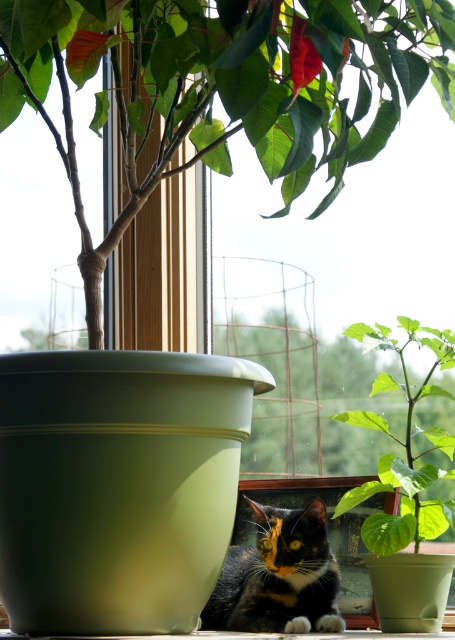
Question: Which point is closer to the camera?

Choices:
 (A) green leafy plant at center
 (B) green matte plant at center
 (C) calico fur cat at center

Answer: (B)

Question: Is green matte plant at center thinner than green leafy plant at center?

Choices:
 (A) no
 (B) yes

Answer: (A)

Question: Estimate the real-world distances between objects in this image. Which object is closer to the green matte plant at center?

Choices:
 (A) calico fur cat at center
 (B) green leafy plant at center

Answer: (B)

Question: Which of the following is the closest to the observer?

Choices:
 (A) green matte plant at center
 (B) green leafy plant at center
 (C) calico fur cat at center

Answer: (A)

Question: Is calico fur cat at center below green leafy plant at center?

Choices:
 (A) no
 (B) yes

Answer: (B)

Question: Is green matte plant at center to the right of calico fur cat at center from the viewer's perspective?

Choices:
 (A) no
 (B) yes

Answer: (A)